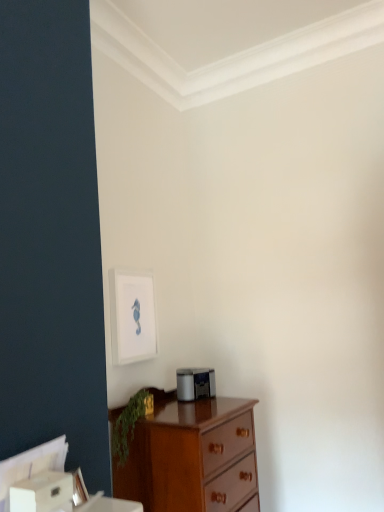
Locate an element on the screen. white matte picture frame at upper center is located at coordinates (132, 316).

You are a GUI agent. You are given a task and a screenshot of the screen. Output one action in this format:
    pyautogui.click(x=<x>, y=<y>)
    Task: Click on the wooden chest of drawers at lower left
    The image size is (384, 512).
    Given the screenshot: What is the action you would take?
    pyautogui.click(x=191, y=456)

The image size is (384, 512). Describe the element at coordinates (191, 456) in the screenshot. I see `wooden chest of drawers at lower left` at that location.

This screenshot has height=512, width=384. In order to click on green leafy plant at lower left in this screenshot , I will do `click(129, 424)`.

I want to click on white matte picture frame at upper center, so click(x=132, y=316).

Is wooden chest of drawers at lower left with white matte picture frame at upper center?

No, wooden chest of drawers at lower left is not touching white matte picture frame at upper center.

Which of these two, wooden chest of drawers at lower left or white matte picture frame at upper center, stands taller?

With more height is wooden chest of drawers at lower left.

Considering the sizes of objects wooden chest of drawers at lower left and white matte picture frame at upper center in the image provided, who is bigger, wooden chest of drawers at lower left or white matte picture frame at upper center?

Bigger between the two is wooden chest of drawers at lower left.

In the scene shown: Is white matte picture frame at upper center to the left of wooden chest of drawers at lower left from the viewer's perspective?

Yes, white matte picture frame at upper center is to the left of wooden chest of drawers at lower left.

Are white matte picture frame at upper center and wooden chest of drawers at lower left making contact?

No, white matte picture frame at upper center is not beside wooden chest of drawers at lower left.

Considering the sizes of objects white matte picture frame at upper center and wooden chest of drawers at lower left in the image provided, who is bigger, white matte picture frame at upper center or wooden chest of drawers at lower left?

wooden chest of drawers at lower left.

Between white matte picture frame at upper center and wooden chest of drawers at lower left, which one is positioned in front?

wooden chest of drawers at lower left.

Which object is positioned more to the left, green leafy plant at lower left or wooden chest of drawers at lower left?

Positioned to the left is green leafy plant at lower left.

From the image's perspective, is green leafy plant at lower left on top of wooden chest of drawers at lower left?

Correct, green leafy plant at lower left appears higher than wooden chest of drawers at lower left in the image.

The width and height of the screenshot is (384, 512). I want to click on plant behind the wooden chest of drawers at lower left, so click(129, 424).

Is green leafy plant at lower left surrounding white matte picture frame at upper center?

No, white matte picture frame at upper center is not surrounded by green leafy plant at lower left.

Is point (131, 416) more distant than point (112, 322)?

No, it is in front of (112, 322).

Between green leafy plant at lower left and white matte picture frame at upper center, which one has more height?

Standing taller between the two is white matte picture frame at upper center.

Find the location of a particular element. plant below the white matte picture frame at upper center (from a real-world perspective) is located at coordinates (129, 424).

From the image's perspective, is white matte picture frame at upper center below green leafy plant at lower left?

No, from the image's perspective, white matte picture frame at upper center is not beneath green leafy plant at lower left.

Measure the distance between white matte picture frame at upper center and green leafy plant at lower left.

white matte picture frame at upper center is 13.52 inches away from green leafy plant at lower left.

Is white matte picture frame at upper center at the right side of green leafy plant at lower left?

Incorrect, white matte picture frame at upper center is not on the right side of green leafy plant at lower left.

Could green leafy plant at lower left be considered to be inside wooden chest of drawers at lower left?

Yes, wooden chest of drawers at lower left is surrounding green leafy plant at lower left.

Is wooden chest of drawers at lower left looking in the opposite direction of green leafy plant at lower left?

Yes.

Which object is positioned more to the left, wooden chest of drawers at lower left or green leafy plant at lower left?

green leafy plant at lower left is more to the left.

Find the location of a particular element. The image size is (384, 512). picture frame that appears above the wooden chest of drawers at lower left (from a real-world perspective) is located at coordinates (132, 316).

You are a GUI agent. You are given a task and a screenshot of the screen. Output one action in this format:
    pyautogui.click(x=<x>, y=<y>)
    Task: Click on the picture frame above the wooden chest of drawers at lower left (from the image's perspective)
    The width and height of the screenshot is (384, 512).
    Given the screenshot: What is the action you would take?
    pyautogui.click(x=132, y=316)

From the image, which object appears to be farther from white matte picture frame at upper center, wooden chest of drawers at lower left or green leafy plant at lower left?

wooden chest of drawers at lower left lies further to white matte picture frame at upper center than the other object.

Considering their positions, is wooden chest of drawers at lower left positioned closer to green leafy plant at lower left than white matte picture frame at upper center?

wooden chest of drawers at lower left lies closer to green leafy plant at lower left than the other object.

Looking at the image, which one is located further to green leafy plant at lower left, white matte picture frame at upper center or wooden chest of drawers at lower left?

white matte picture frame at upper center.

From the image, which object appears to be farther from white matte picture frame at upper center, green leafy plant at lower left or wooden chest of drawers at lower left?

Among the two, wooden chest of drawers at lower left is located further to white matte picture frame at upper center.

Considering their positions, is green leafy plant at lower left positioned further to wooden chest of drawers at lower left than white matte picture frame at upper center?

Among the two, white matte picture frame at upper center is located further to wooden chest of drawers at lower left.

From the image, which object appears to be farther from wooden chest of drawers at lower left, white matte picture frame at upper center or green leafy plant at lower left?

white matte picture frame at upper center lies further to wooden chest of drawers at lower left than the other object.

Find the location of a particular element. The image size is (384, 512). plant between white matte picture frame at upper center and wooden chest of drawers at lower left in the vertical direction is located at coordinates [129, 424].